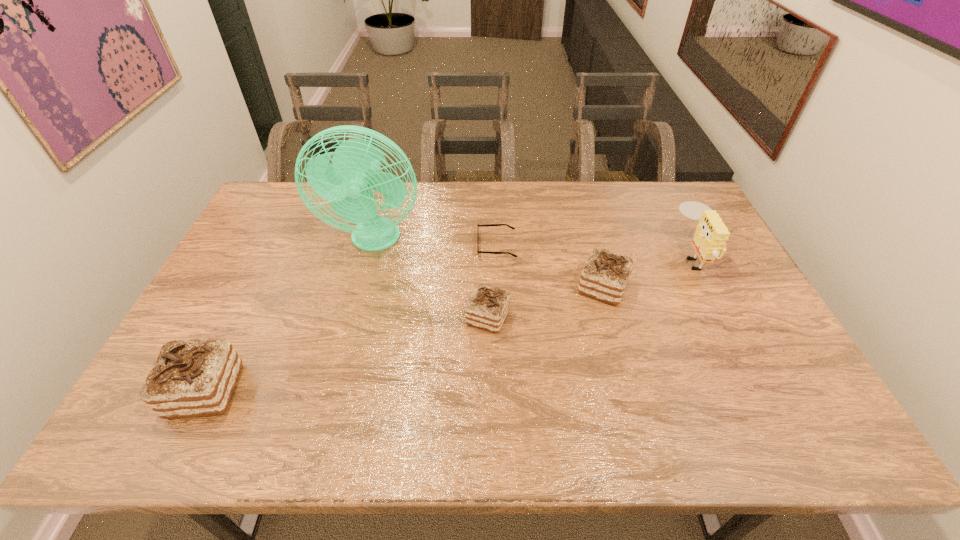
This screenshot has width=960, height=540. What are the coordinates of `the leftmost object` in the screenshot? It's located at pos(191,378).

The width and height of the screenshot is (960, 540). Find the location of `the nearest object`. the nearest object is located at coordinates (191, 378).

Find the location of a particular element. This screenshot has height=540, width=960. the second shortest object is located at coordinates (487, 308).

Where is `the second chocolate cake from right to left`? the second chocolate cake from right to left is located at coordinates (487, 308).

You are a GUI agent. You are given a task and a screenshot of the screen. Output one action in this format:
    pyautogui.click(x=<x>, y=<y>)
    Task: Click on the second tallest chocolate cake
    The height and width of the screenshot is (540, 960).
    Given the screenshot: What is the action you would take?
    pyautogui.click(x=605, y=275)

Locate an element on the screen. The width and height of the screenshot is (960, 540). the rightmost chocolate cake is located at coordinates (605, 275).

The width and height of the screenshot is (960, 540). Identify the location of sunglasses. (489, 252).

Locate an element on the screen. The height and width of the screenshot is (540, 960). fan is located at coordinates (356, 168).

At what (x,y) coordinates should I click in order to perform the action: click on the tallest object. Please return your answer as a coordinate pair (x, y). The height and width of the screenshot is (540, 960). Looking at the image, I should click on (356, 168).

Locate an element on the screen. sponge is located at coordinates (711, 234).